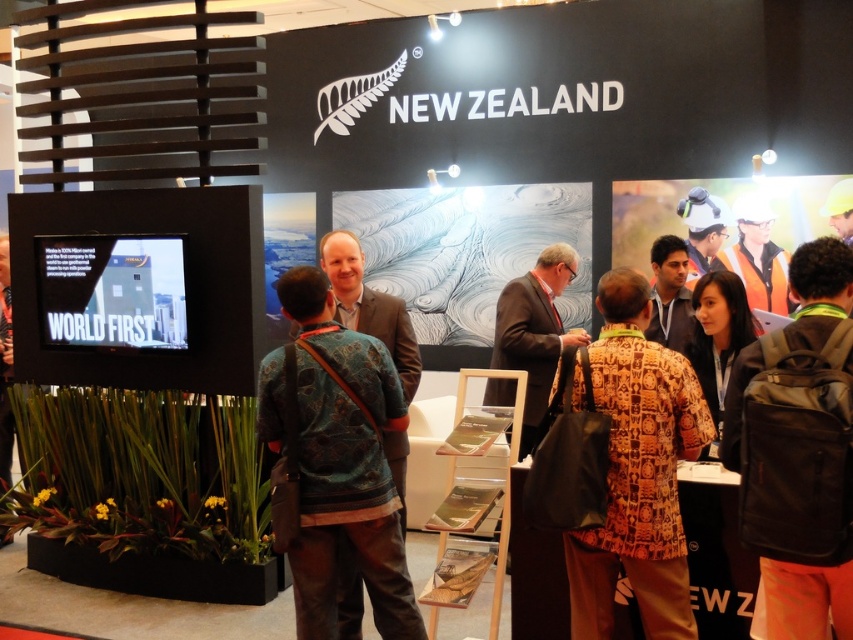
Question: Can you confirm if brown patterned shirt at center is bigger than orange safety vest at center?

Choices:
 (A) no
 (B) yes

Answer: (B)

Question: Is black fabric backpack at center-right behind patterned fabric sweater at center?

Choices:
 (A) no
 (B) yes

Answer: (A)

Question: Estimate the real-world distances between objects in this image. Which object is farther from the brown patterned shirt at center?

Choices:
 (A) patterned fabric sweater at center
 (B) matte brown suit at center

Answer: (B)

Question: Which of these objects is positioned closest to the patterned fabric sweater at center?

Choices:
 (A) black fabric backpack at center-right
 (B) orange safety vest at center

Answer: (A)

Question: Which of the following is the closest to the observer?

Choices:
 (A) (711, 433)
 (B) (389, 320)
 (C) (770, 240)
 (D) (735, 381)

Answer: (D)

Question: Does patterned fabric sweater at center appear under matte brown suit at center?

Choices:
 (A) no
 (B) yes

Answer: (B)